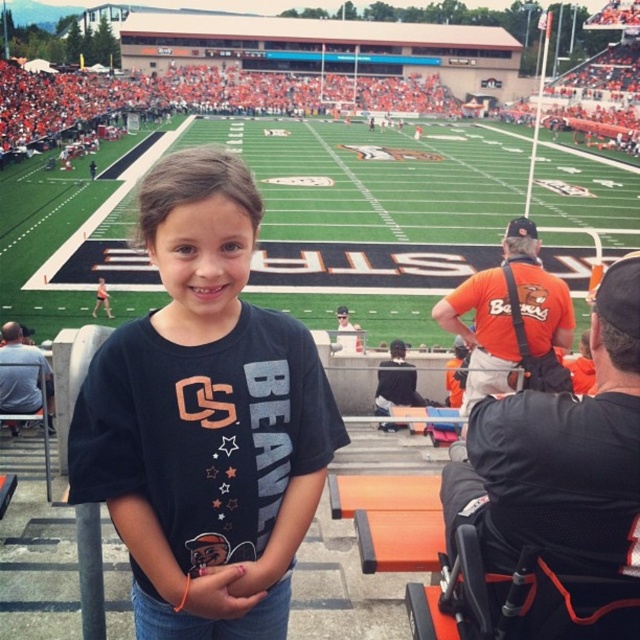
Question: Does black matte shirt at center come in front of orange fabric wheelchair at lower right?

Choices:
 (A) yes
 (B) no

Answer: (B)

Question: Which object appears farthest from the camera in this image?

Choices:
 (A) black matte shirt at center
 (B) orange fabric wheelchair at lower right
 (C) green turf football field at center

Answer: (C)

Question: Which point is closer to the camera?

Choices:
 (A) (84, 396)
 (B) (557, 598)

Answer: (B)

Question: Can you confirm if green turf football field at center is positioned below orange fabric wheelchair at lower right?

Choices:
 (A) yes
 (B) no

Answer: (B)

Question: Which point is closer to the camera?

Choices:
 (A) orange fabric wheelchair at lower right
 (B) green turf football field at center
 (C) black matte shirt at center

Answer: (A)

Question: Can you confirm if black matte shirt at center is smaller than orange fabric wheelchair at lower right?

Choices:
 (A) yes
 (B) no

Answer: (B)